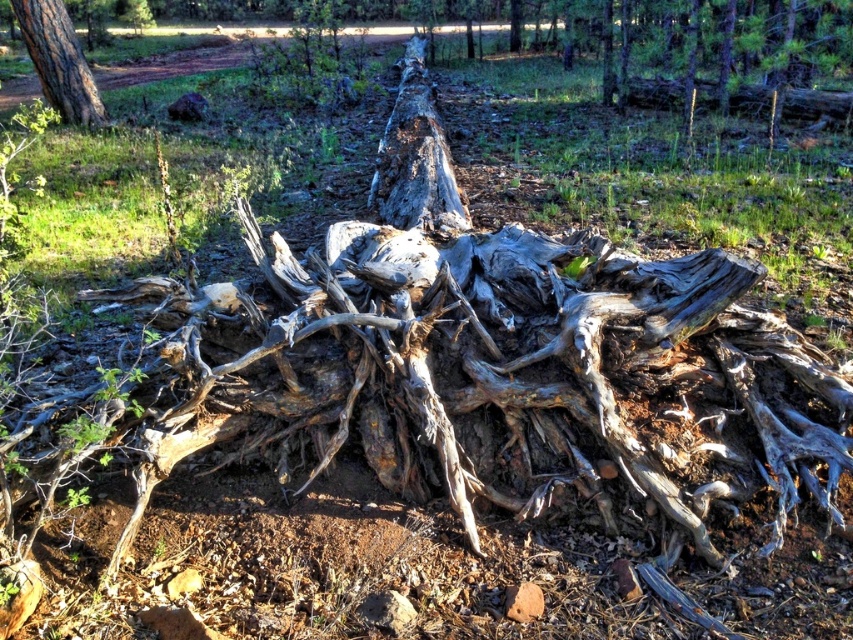
Which is in front, point (405, 180) or point (50, 54)?

Point (405, 180) is in front.

Does gray rough bark tree trunk at center have a lesser width compared to gray rough bark tree trunk at upper left?

Correct, gray rough bark tree trunk at center's width is less than gray rough bark tree trunk at upper left's.

Identify the location of gray rough bark tree trunk at center. The width and height of the screenshot is (853, 640). (415, 156).